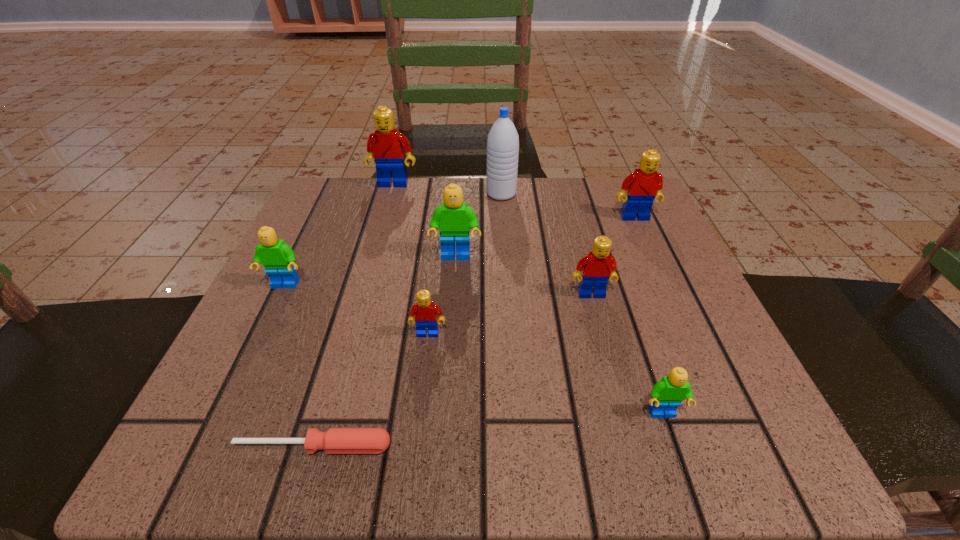
Where is `object present at the far left corner`? The height and width of the screenshot is (540, 960). object present at the far left corner is located at coordinates (386, 147).

Locate an element on the screen. object positioned at the near left corner is located at coordinates (335, 440).

Identify the location of object present at the far right corner. This screenshot has height=540, width=960. (645, 184).

Find the location of `object at the near right corner`. object at the near right corner is located at coordinates (666, 396).

Where is `vacant space at the far edge of the desktop`? The height and width of the screenshot is (540, 960). vacant space at the far edge of the desktop is located at coordinates (466, 178).

Find the location of a particular element. The width and height of the screenshot is (960, 540). vacant space at the near edge of the desktop is located at coordinates (445, 427).

Where is `free space at the right edge of the desktop`? free space at the right edge of the desktop is located at coordinates (x=697, y=398).

At what (x,y) coordinates should I click in order to perform the action: click on free space at the far left corner of the desktop. Please return your answer as a coordinate pair (x, y). This screenshot has height=540, width=960. Looking at the image, I should click on (375, 179).

The image size is (960, 540). In order to click on free region at the near left corner of the desktop in this screenshot , I will do `click(276, 455)`.

Identify the location of vacant space at the far right corner of the desktop. The width and height of the screenshot is (960, 540). (652, 212).